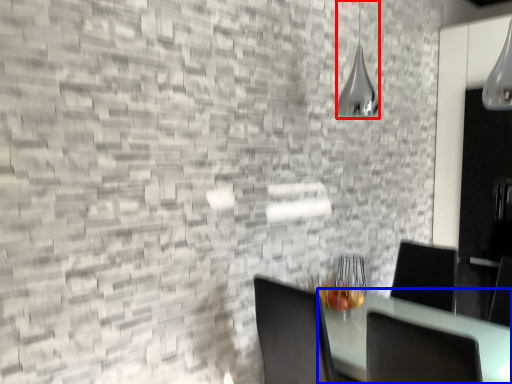
Question: Among these objects, which one is farthest to the camera, lamp (highlighted by a red box) or table (highlighted by a blue box)?

Choices:
 (A) lamp
 (B) table

Answer: (A)